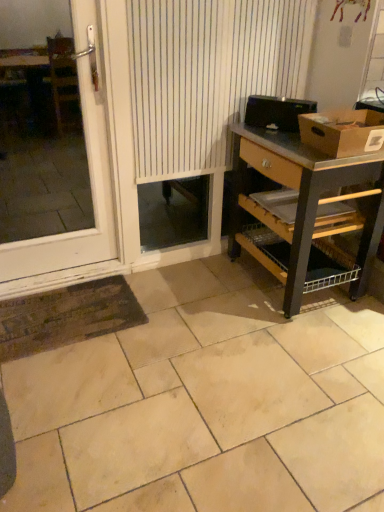
Question: Does point (334, 112) appear closer or farther from the camera than point (89, 177)?

Choices:
 (A) closer
 (B) farther

Answer: (A)

Question: Is brown cardboard box at upper right wider or thinner than white plastic door at left?

Choices:
 (A) wide
 (B) thin

Answer: (A)

Question: Which is farther from the white striped curtain at center?

Choices:
 (A) white plastic door at left
 (B) beige ceramic tile at center
 (C) brown cardboard box at upper right
 (D) wooden desk at right

Answer: (B)

Question: Which object is the farthest from the brown cardboard box at upper right?

Choices:
 (A) white plastic door at left
 (B) beige ceramic tile at center
 (C) wooden desk at right
 (D) white striped curtain at center

Answer: (A)